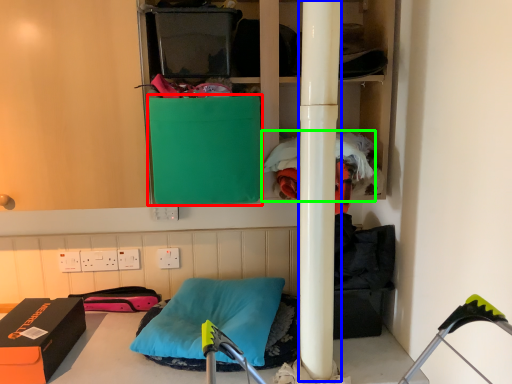
Question: Which object is the closest to the box (highlighted by a red box)? Choose among these: beam (highlighted by a blue box) or clothing (highlighted by a green box).

Choices:
 (A) beam
 (B) clothing

Answer: (B)